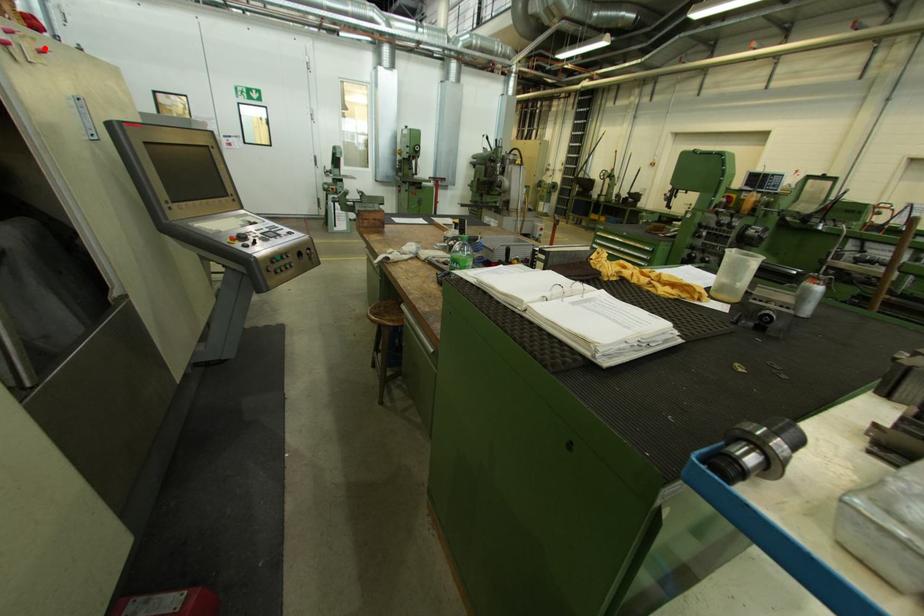
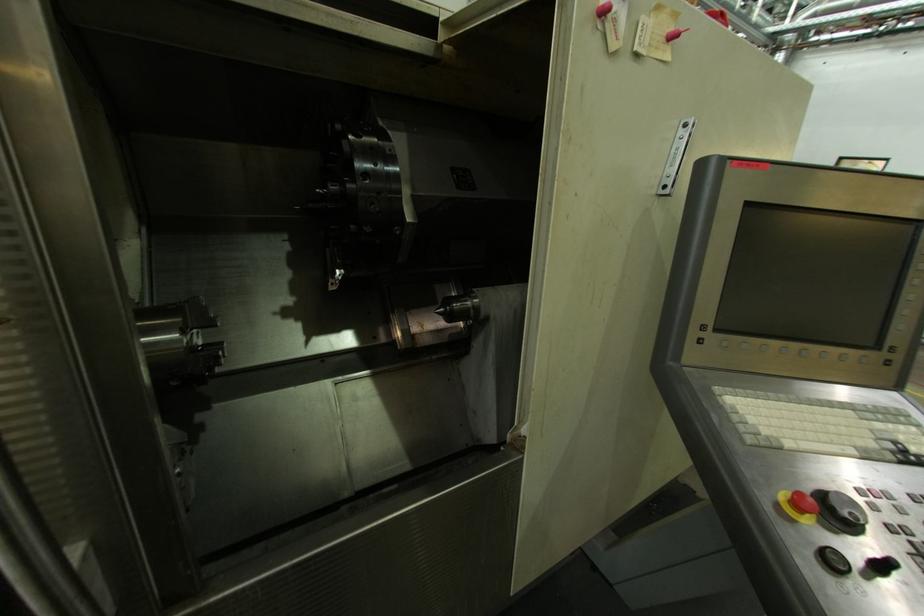
The point at the highlighted location is marked in the first image. Where is the corresponding point in the second image?

(677, 30)